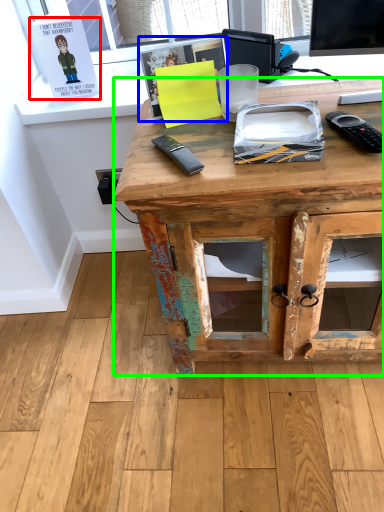
Question: Considering the real-world distances, which object is closest to book (highlighted by a red box)? book (highlighted by a blue box) or desk (highlighted by a green box).

Choices:
 (A) book
 (B) desk

Answer: (A)